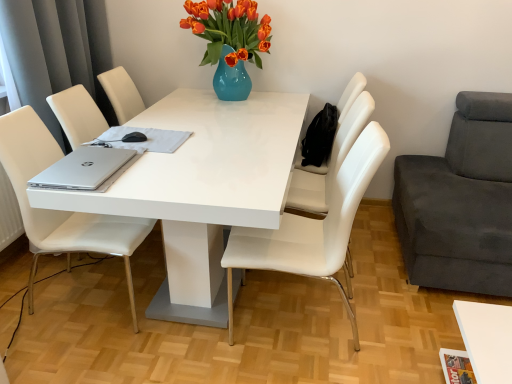
The height and width of the screenshot is (384, 512). What are the coordinates of `vacant space in front of white leather chair at left, which is counted as the 4th chair, starting from the right` in the screenshot? It's located at (83, 353).